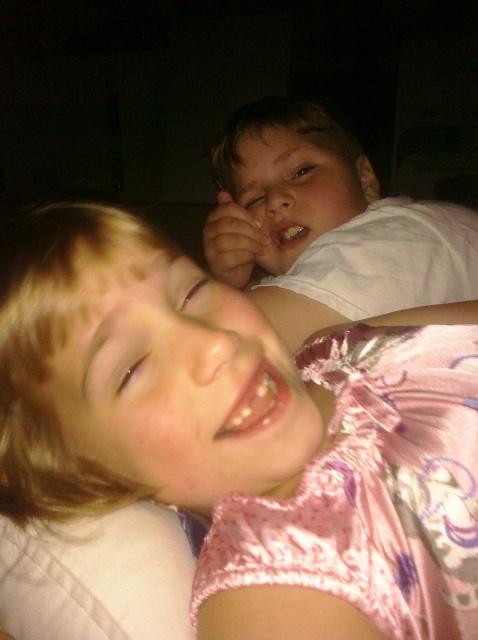
You are a photographer trying to capture a closeup of the smooth skin face at upper center without including the white cotton shirt at upper center. Given their sizes, is this possible?

The white cotton shirt at upper center is larger than the smooth skin face at upper center, so it might be challenging to frame the shot to exclude the shirt entirely. Adjusting the camera angle or moving closer might help focus solely on the face.

What are the exact coordinates of the pink satin face at lower left?

The pink satin face at lower left is located at point (183, 385).

You are a photographer trying to capture a clear shot of the smooth skin face at upper center. However, the white cotton shirt at upper center is blocking your view. Can you adjust your position to see the face without moving any objects?

The white cotton shirt at upper center is in front of the smooth skin face at upper center, so moving your camera position slightly to the side or angle might allow you to see around the shirt to capture the face without moving any objects.